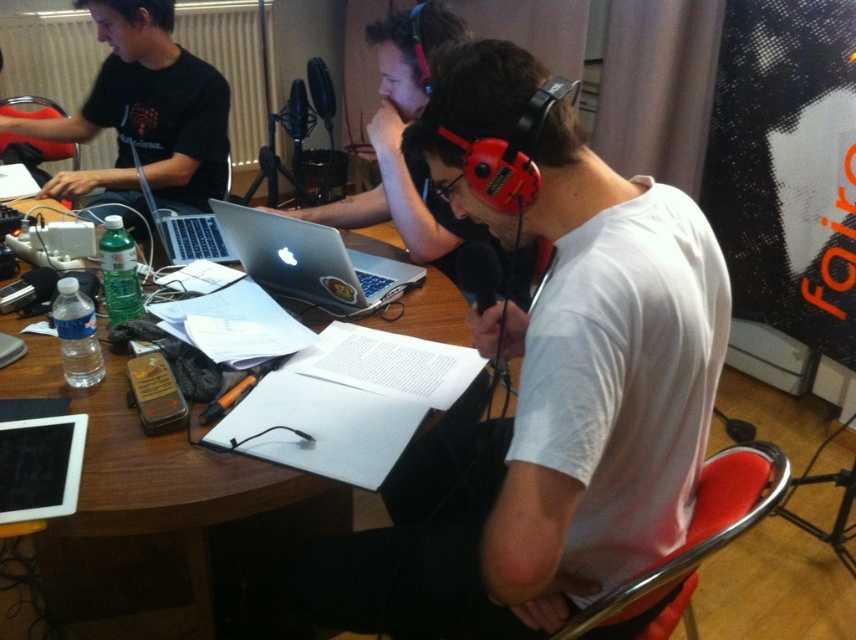
Question: Is wooden at center smaller than silver metallic laptop at upper left?

Choices:
 (A) yes
 (B) no

Answer: (A)

Question: Among these objects, which one is farthest from the camera?

Choices:
 (A) white cotton shirt at center
 (B) silver metallic laptop at center
 (C) matte black shirt at left

Answer: (C)

Question: Which object appears farthest from the camera in this image?

Choices:
 (A) wooden at center
 (B) white cotton shirt at center
 (C) silver metallic laptop at center
 (D) silver metallic laptop at upper left

Answer: (D)

Question: Does wooden at center lie in front of silver metallic laptop at center?

Choices:
 (A) no
 (B) yes

Answer: (B)

Question: Among these points, which one is farthest from the camera?

Choices:
 (A) (562, 305)
 (B) (105, 416)

Answer: (B)

Question: Can you confirm if white cotton shirt at center is smaller than wooden at center?

Choices:
 (A) yes
 (B) no

Answer: (B)